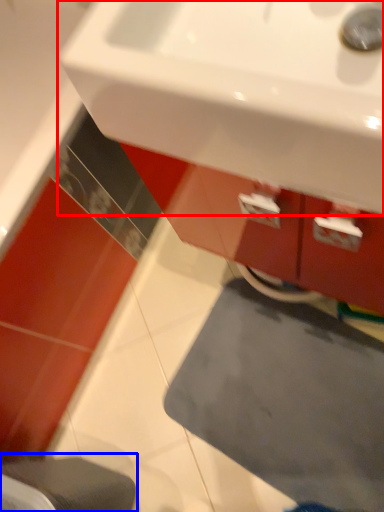
Question: Which object is closer to the camera taking this photo, sink (highlighted by a red box) or step stool (highlighted by a blue box)?

Choices:
 (A) sink
 (B) step stool

Answer: (A)